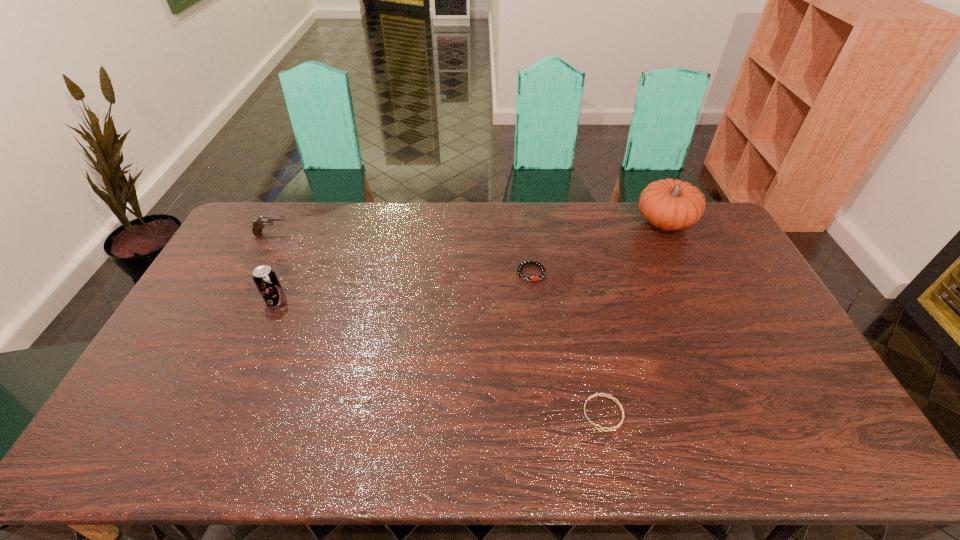
Where is `the rightmost object`? The image size is (960, 540). the rightmost object is located at coordinates (669, 204).

Where is `the second tallest object`? This screenshot has height=540, width=960. the second tallest object is located at coordinates (264, 277).

Locate an element on the screen. This screenshot has height=540, width=960. the second object from left to right is located at coordinates (264, 277).

The width and height of the screenshot is (960, 540). What are the coordinates of `the leftmost object` in the screenshot? It's located at (259, 224).

You are a GUI agent. You are given a task and a screenshot of the screen. Output one action in this format:
    pyautogui.click(x=<x>, y=<y>)
    Task: Click on the pistol
    The image size is (960, 540).
    Given the screenshot: What is the action you would take?
    pyautogui.click(x=259, y=224)

Locate an element on the screen. This screenshot has height=540, width=960. the third object from right to left is located at coordinates (528, 262).

The image size is (960, 540). I want to click on the third farthest object, so click(x=528, y=262).

What are the coordinates of `the nearer bracelet` in the screenshot? It's located at (597, 394).

This screenshot has height=540, width=960. Identify the location of the fourth object from left to right. (597, 394).

At what (x,y) coordinates should I click in order to perform the action: click on free space located 0.290m on the front of the rightmost object. Please return your answer as a coordinate pair (x, y). This screenshot has width=960, height=540. Looking at the image, I should click on (704, 301).